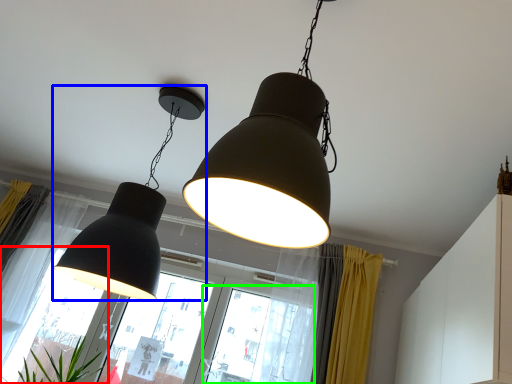
Question: Considering the real-world distances, which object is closest to window (highlighted by a red box)? lamp (highlighted by a blue box) or window (highlighted by a green box).

Choices:
 (A) lamp
 (B) window

Answer: (B)